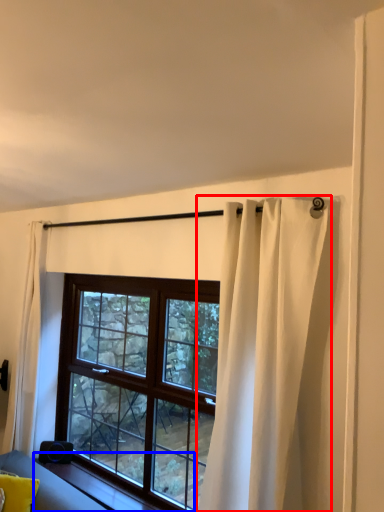
Question: Which of the following is the closest to the observer, curtain (highlighted by a red box) or window sill (highlighted by a blue box)?

Choices:
 (A) curtain
 (B) window sill

Answer: (A)